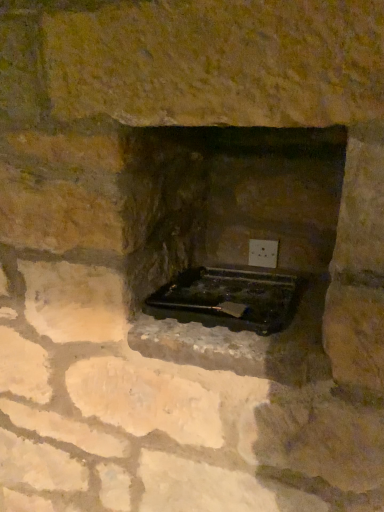
Where is `vacant position to the left of white plastic electric outlet at center`? vacant position to the left of white plastic electric outlet at center is located at coordinates (232, 262).